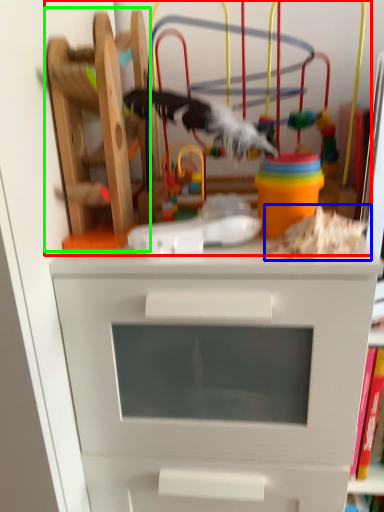
Question: Which is farther away from toy (highlighted by a red box)? toy (highlighted by a blue box) or toy (highlighted by a green box)?

Choices:
 (A) toy
 (B) toy

Answer: (A)